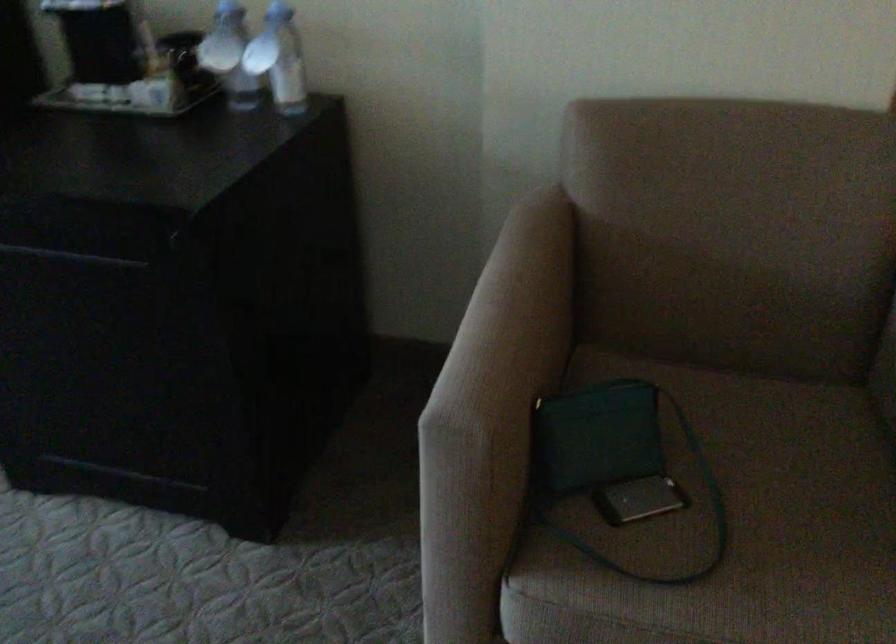
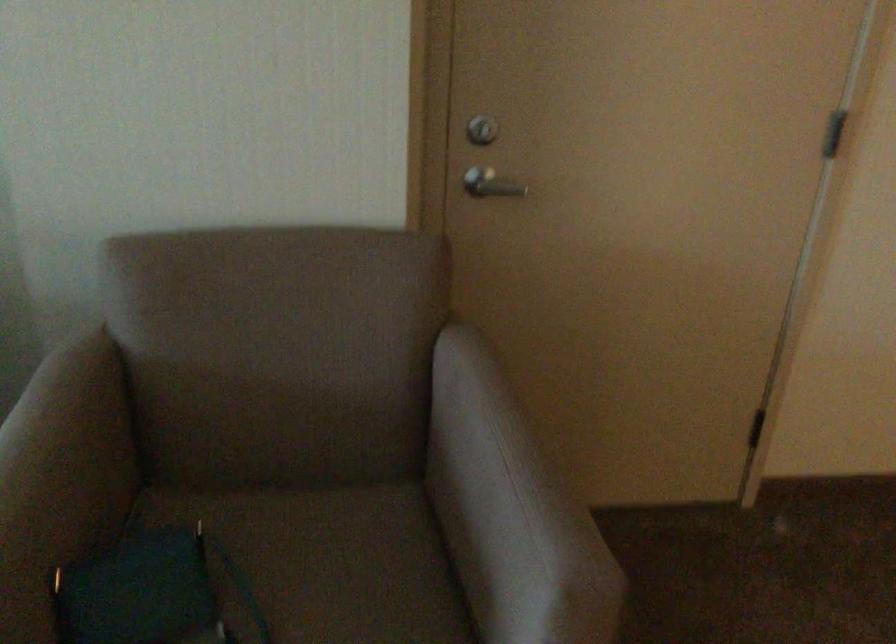
Question: What movement of the cameraman would produce the second image?

Choices:
 (A) Left
 (B) Right
 (C) Forward
 (D) Backward

Answer: (B)